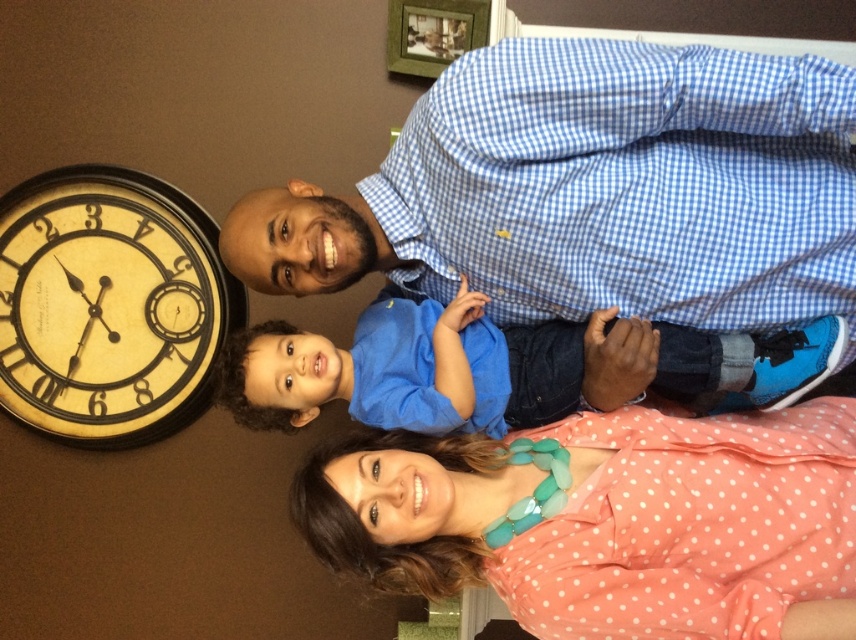
Does blue checkered shirt at upper center appear over pink polka dot blouse at lower center?

Yes, blue checkered shirt at upper center is above pink polka dot blouse at lower center.

Measure the distance from blue checkered shirt at upper center to pink polka dot blouse at lower center.

blue checkered shirt at upper center is 31.25 centimeters away from pink polka dot blouse at lower center.

Who is more distant from viewer, (492, 310) or (566, 516)?

The point (492, 310) is behind.

The height and width of the screenshot is (640, 856). Find the location of `blue checkered shirt at upper center`. blue checkered shirt at upper center is located at coordinates (593, 192).

Which is behind, point (848, 109) or point (698, 412)?

The point (698, 412) is more distant.

Where is `blue checkered shirt at upper center`? blue checkered shirt at upper center is located at coordinates (593, 192).

Does blue checkered shirt at upper center appear over yellow painted wood clock at left?

Indeed, blue checkered shirt at upper center is positioned over yellow painted wood clock at left.

Does blue checkered shirt at upper center come behind yellow painted wood clock at left?

No.

Which is in front, point (682, 170) or point (183, 371)?

Positioned in front is point (682, 170).

Locate an element on the screen. blue checkered shirt at upper center is located at coordinates (593, 192).